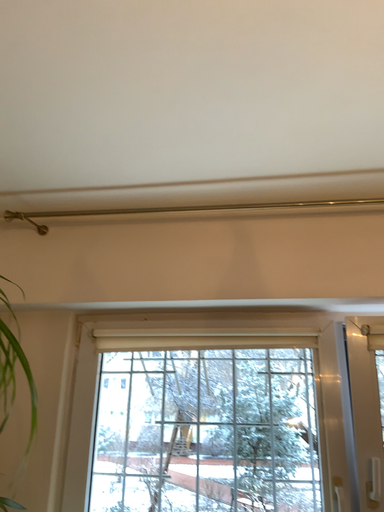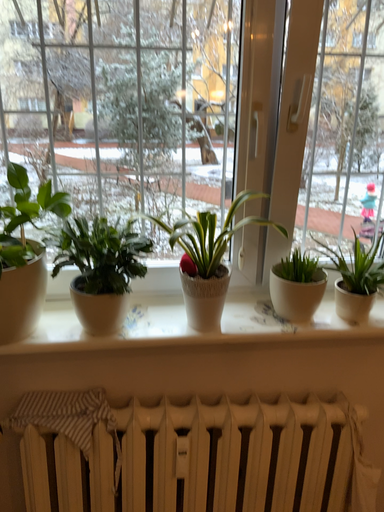
Question: Which way did the camera rotate in the video?

Choices:
 (A) rotated downward
 (B) rotated upward

Answer: (A)